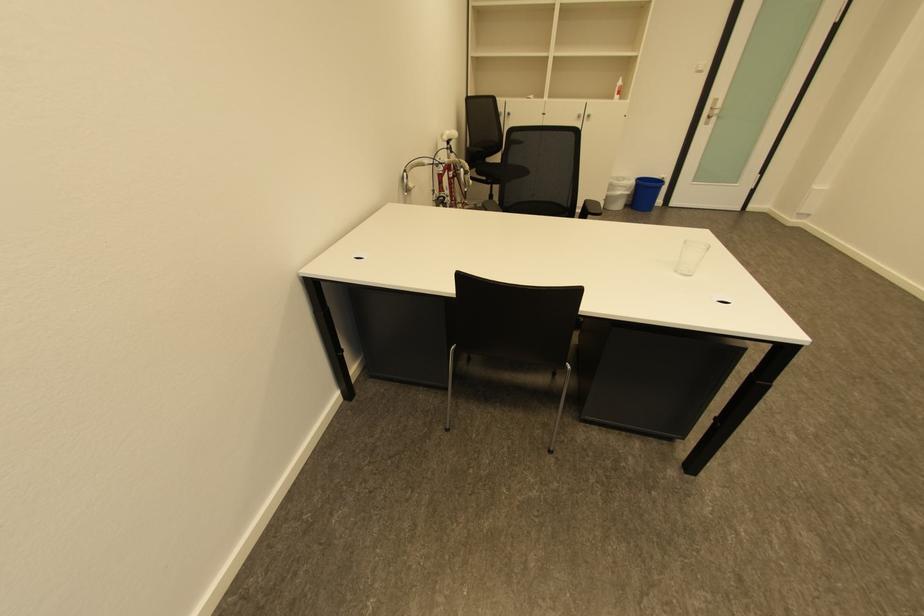
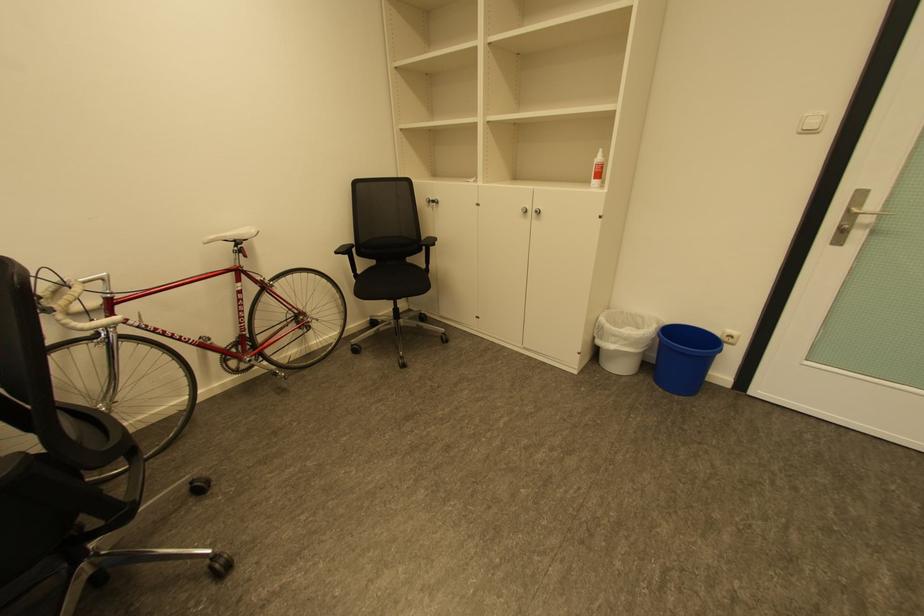
Locate, in the second image, the point that corresponds to (x=718, y=108) in the first image.

(855, 211)